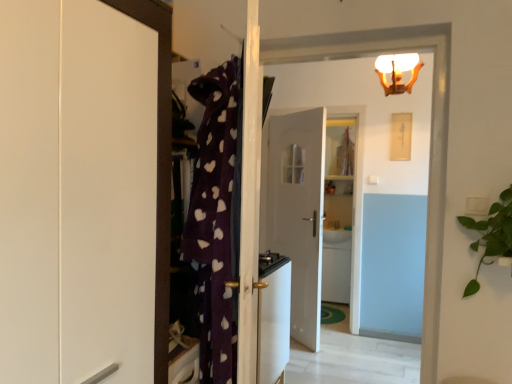
Measure the distance between point (434, 27) and camera.

Point (434, 27) is 5.75 feet away from camera.

From the picture: What is the approximate width of white glossy sink at center?

white glossy sink at center is 13.44 inches wide.

Where is `white glossy cabinet at left`? The width and height of the screenshot is (512, 384). white glossy cabinet at left is located at coordinates (76, 192).

This screenshot has height=384, width=512. I want to click on white glossy stove at center, so click(274, 316).

In order to face white glossy door at center, arranged as the 1th door when viewed from the back, should I rotate leftwards or rightwards?

Rotate right and turn 5.353 degrees.

Locate an element on the screen. The image size is (512, 384). white glossy door at upper center, acting as the first door starting from the front is located at coordinates (431, 123).

Consider the image. From the image's perspective, which object appears higher, white glossy cabinet at left or green leafy plant at right?

white glossy cabinet at left.

Is white glossy cabinet at left oriented away from green leafy plant at right?

No.

From a real-world perspective, between white glossy cabinet at left and green leafy plant at right, who is vertically higher?

white glossy cabinet at left.

Would you say white glossy cabinet at left is a long distance from green leafy plant at right?

white glossy cabinet at left is positioned a significant distance from green leafy plant at right.

Is white glossy stove at center inside white frosted glass light fixture at upper center?

That's incorrect, white glossy stove at center is not inside white frosted glass light fixture at upper center.

Considering the relative sizes of white frosted glass light fixture at upper center and white glossy stove at center in the image provided, is white frosted glass light fixture at upper center bigger than white glossy stove at center?

No.

Is white frosted glass light fixture at upper center closer to camera compared to white glossy stove at center?

No, the depth of white frosted glass light fixture at upper center is greater than that of white glossy stove at center.

Consider the image. From the image's perspective, is white frosted glass light fixture at upper center located above or below white glossy stove at center?

white frosted glass light fixture at upper center is situated higher than white glossy stove at center in the image.

From the image's perspective, which one is positioned lower, green leafy plant at right or white glossy sink at center?

white glossy sink at center is shown below in the image.

Considering the relative positions of green leafy plant at right and white glossy sink at center in the image provided, is green leafy plant at right in front of white glossy sink at center?

Yes, green leafy plant at right is in front of white glossy sink at center.

Is point (494, 239) in front of point (337, 235)?

That is True.

Between green leafy plant at right and white glossy sink at center, which one has less height?

Standing shorter between the two is white glossy sink at center.

Does point (323, 127) come farther from viewer compared to point (508, 239)?

Yes, point (323, 127) is behind point (508, 239).

From a real-world perspective, who is located lower, white glossy door at center, arranged as the 1th door when viewed from the back, or green leafy plant at right?

In real-world perspective, white glossy door at center, arranged as the 1th door when viewed from the back, is lower.

Considering the sizes of objects white glossy door at center, arranged as the 1th door when viewed from the back, and green leafy plant at right in the image provided, who is shorter, white glossy door at center, arranged as the 1th door when viewed from the back, or green leafy plant at right?

Standing shorter between the two is green leafy plant at right.

Considering the sizes of objects white glossy door at center, acting as the second door starting from the front, and green leafy plant at right in the image provided, who is smaller, white glossy door at center, acting as the second door starting from the front, or green leafy plant at right?

Answer: Smaller between the two is green leafy plant at right.

Which object is more forward, white glossy cabinet at left or white glossy door at center, arranged as the 1th door when viewed from the back?

white glossy cabinet at left is closer to the camera.

Where is `cabinetry on the left of white glossy door at center, acting as the second door starting from the front`? Image resolution: width=512 pixels, height=384 pixels. cabinetry on the left of white glossy door at center, acting as the second door starting from the front is located at coordinates point(76,192).

Between white glossy cabinet at left and white glossy door at center, arranged as the 1th door when viewed from the back, which one appears on the left side from the viewer's perspective?

white glossy cabinet at left.

Can you confirm if green leafy plant at right is wider than white glossy door at upper center, acting as the first door starting from the front?

Indeed, green leafy plant at right has a greater width compared to white glossy door at upper center, acting as the first door starting from the front.

Would you say green leafy plant at right is inside or outside white glossy door at upper center, which ranks as the 2th door in back-to-front order?

green leafy plant at right exists outside the volume of white glossy door at upper center, which ranks as the 2th door in back-to-front order.

From a real-world perspective, is green leafy plant at right over white glossy door at upper center, acting as the first door starting from the front?

Yes.

From the image's perspective, is white glossy door at upper center, which ranks as the 2th door in back-to-front order, above or below white glossy cabinet at left?

white glossy door at upper center, which ranks as the 2th door in back-to-front order, is situated lower than white glossy cabinet at left in the image.

From a real-world perspective, which object stands above the other?

From a 3D spatial view, white glossy cabinet at left is above.

Looking at the image, does white glossy door at upper center, which ranks as the 2th door in back-to-front order, seem bigger or smaller compared to white glossy cabinet at left?

Clearly, white glossy door at upper center, which ranks as the 2th door in back-to-front order, is smaller in size than white glossy cabinet at left.

Find the location of a particular element. cabinetry lying above the white glossy door at upper center, which ranks as the 2th door in back-to-front order (from the image's perspective) is located at coordinates (76, 192).

At what (x,y) coordinates should I click in order to perform the action: click on cabinetry in front of the green leafy plant at right. Please return your answer as a coordinate pair (x, y). Image resolution: width=512 pixels, height=384 pixels. Looking at the image, I should click on (76, 192).

Identify the location of appliance located below the white frosted glass light fixture at upper center (from the image's perspective). (274, 316).

Looking at the image, which one is located further to green leafy plant at right, white frosted glass light fixture at upper center or white glossy door at upper center, acting as the first door starting from the front?

white frosted glass light fixture at upper center is further to green leafy plant at right.

Which object lies further to the anchor point white glossy door at upper center, acting as the first door starting from the front, white glossy sink at center or white glossy cabinet at left?

white glossy sink at center lies further to white glossy door at upper center, acting as the first door starting from the front, than the other object.

Which object lies nearer to the anchor point white frosted glass light fixture at upper center, white glossy sink at center or white glossy door at upper center, which ranks as the 2th door in back-to-front order?

white glossy door at upper center, which ranks as the 2th door in back-to-front order, is positioned closer to the anchor white frosted glass light fixture at upper center.

Looking at the image, which one is located further to white glossy door at center, acting as the second door starting from the front, white glossy sink at center or green leafy plant at right?

Based on the image, green leafy plant at right appears to be further to white glossy door at center, acting as the second door starting from the front.

Based on their spatial positions, is white glossy door at upper center, which ranks as the 2th door in back-to-front order, or white glossy stove at center closer to white glossy door at center, acting as the second door starting from the front?

white glossy stove at center is closer to white glossy door at center, acting as the second door starting from the front.

Based on their spatial positions, is green leafy plant at right or white glossy door at center, acting as the second door starting from the front, closer to white glossy stove at center?

white glossy door at center, acting as the second door starting from the front, is positioned closer to the anchor white glossy stove at center.

From the image, which object appears to be nearer to white glossy door at upper center, acting as the first door starting from the front, white frosted glass light fixture at upper center or white glossy door at center, acting as the second door starting from the front?

white frosted glass light fixture at upper center.

Estimate the real-world distances between objects in this image. Which object is closer to white frosted glass light fixture at upper center, green leafy plant at right or white glossy sink at center?

green leafy plant at right is closer to white frosted glass light fixture at upper center.

The height and width of the screenshot is (384, 512). I want to click on appliance between white glossy cabinet at left and white glossy sink at center along the z-axis, so [x=274, y=316].

Identify the location of appliance positioned between white glossy cabinet at left and white frosted glass light fixture at upper center from near to far. Image resolution: width=512 pixels, height=384 pixels. (274, 316).

Locate an element on the screen. door located between white glossy cabinet at left and white frosted glass light fixture at upper center in the depth direction is located at coordinates (431, 123).

This screenshot has height=384, width=512. I want to click on door between green leafy plant at right and white frosted glass light fixture at upper center along the z-axis, so click(x=431, y=123).